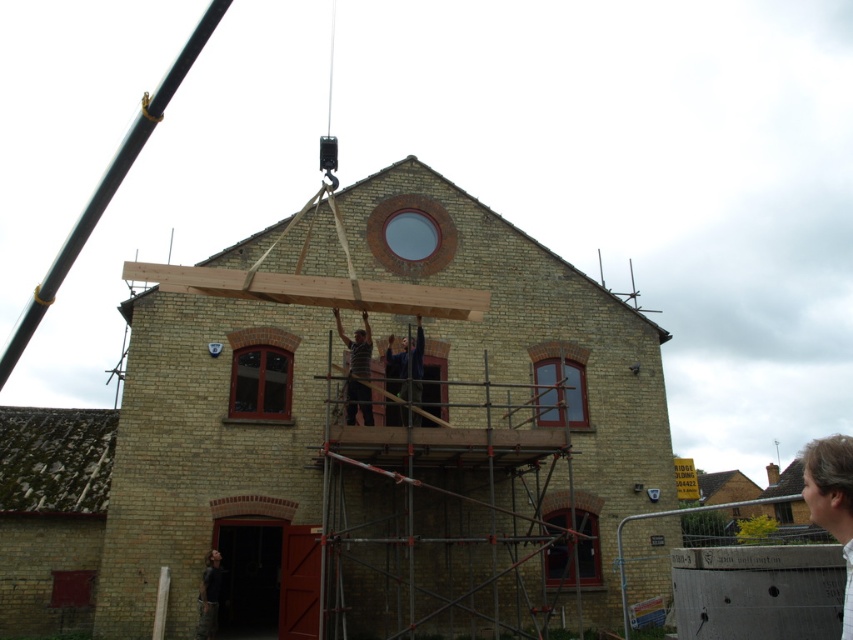
Can you confirm if dark gray shirt at center is shorter than dark blue shirt at center?

In fact, dark gray shirt at center may be taller than dark blue shirt at center.

The width and height of the screenshot is (853, 640). What do you see at coordinates (357, 369) in the screenshot? I see `dark gray shirt at center` at bounding box center [357, 369].

Measure the distance between dark gray shirt at center and camera.

dark gray shirt at center and camera are 40.40 meters apart from each other.

Where is `dark gray shirt at center`? The image size is (853, 640). dark gray shirt at center is located at coordinates (357, 369).

Can you confirm if light brown hair at upper right is smaller than dark gray shirt at center?

Actually, light brown hair at upper right might be larger than dark gray shirt at center.

Where is `light brown hair at upper right`? The width and height of the screenshot is (853, 640). light brown hair at upper right is located at coordinates (833, 500).

Is point (842, 513) positioned in front of point (358, 364)?

Yes, point (842, 513) is in front of point (358, 364).

Where is `light brown hair at upper right`? The image size is (853, 640). light brown hair at upper right is located at coordinates (833, 500).

Does light brown hair at upper right have a greater height compared to matte brown window at center?

Correct, light brown hair at upper right is much taller as matte brown window at center.

What do you see at coordinates (833, 500) in the screenshot? This screenshot has height=640, width=853. I see `light brown hair at upper right` at bounding box center [833, 500].

Between point (827, 442) and point (581, 422), which one is positioned in front?

Positioned in front is point (827, 442).

Locate an element on the screen. Image resolution: width=853 pixels, height=640 pixels. light brown hair at upper right is located at coordinates (833, 500).